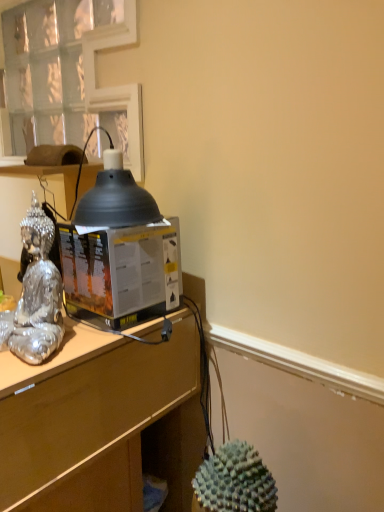
Question: Is matte black lampshade at upper center inside transparent plastic desktop computer at center?

Choices:
 (A) yes
 (B) no

Answer: (B)

Question: Is the surface of transparent plastic desktop computer at center in direct contact with matte black lampshade at upper center?

Choices:
 (A) no
 (B) yes

Answer: (A)

Question: Would you say transparent plastic desktop computer at center is outside matte black lampshade at upper center?

Choices:
 (A) no
 (B) yes

Answer: (B)

Question: Considering the relative sizes of transparent plastic desktop computer at center and matte black lampshade at upper center in the image provided, is transparent plastic desktop computer at center thinner than matte black lampshade at upper center?

Choices:
 (A) no
 (B) yes

Answer: (A)

Question: Does transparent plastic desktop computer at center have a larger size compared to matte black lampshade at upper center?

Choices:
 (A) yes
 (B) no

Answer: (A)

Question: Is transparent plastic desktop computer at center further to the viewer compared to matte black lampshade at upper center?

Choices:
 (A) no
 (B) yes

Answer: (B)

Question: Considering the relative sizes of matte black lampshade at upper center and matte black lampshade at upper left in the image provided, is matte black lampshade at upper center taller than matte black lampshade at upper left?

Choices:
 (A) no
 (B) yes

Answer: (A)

Question: Is matte black lampshade at upper center thinner than matte black lampshade at upper left?

Choices:
 (A) yes
 (B) no

Answer: (A)

Question: Can you confirm if matte black lampshade at upper center is bigger than matte black lampshade at upper left?

Choices:
 (A) yes
 (B) no

Answer: (B)

Question: Considering the relative positions of matte black lampshade at upper center and matte black lampshade at upper left in the image provided, is matte black lampshade at upper center to the right of matte black lampshade at upper left from the viewer's perspective?

Choices:
 (A) no
 (B) yes

Answer: (B)

Question: Is matte black lampshade at upper center wider than matte black lampshade at upper left?

Choices:
 (A) yes
 (B) no

Answer: (B)

Question: Can you confirm if matte black lampshade at upper center is shorter than matte black lampshade at upper left?

Choices:
 (A) yes
 (B) no

Answer: (A)

Question: Are silver reflective statue at left and matte black lampshade at upper left far apart?

Choices:
 (A) no
 (B) yes

Answer: (A)